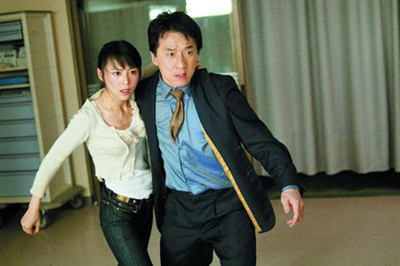
At what (x,y) coordinates should I click in order to perform the action: click on wheels on cart. Please return your answer as a coordinate pair (x, y). This screenshot has width=400, height=266. Looking at the image, I should click on (82, 199), (46, 220).